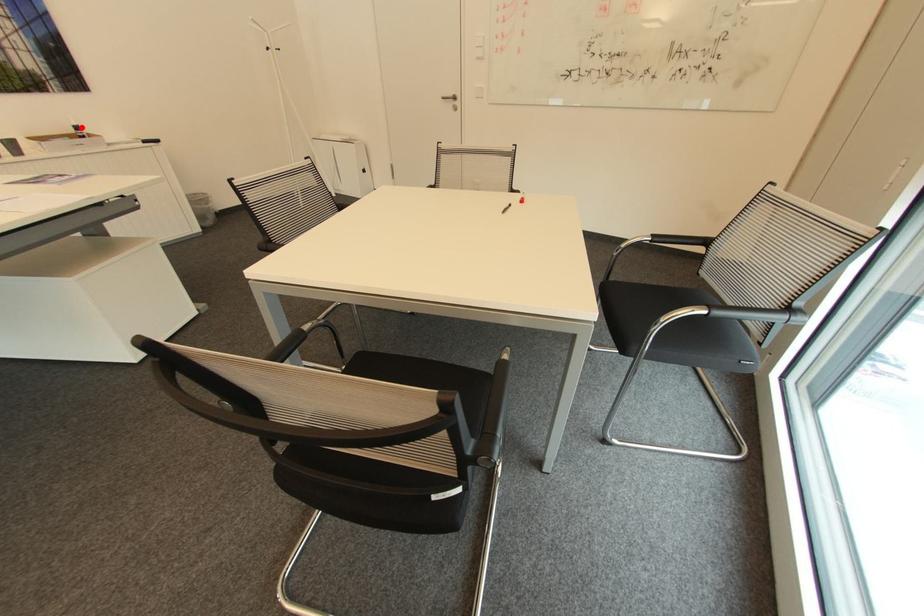
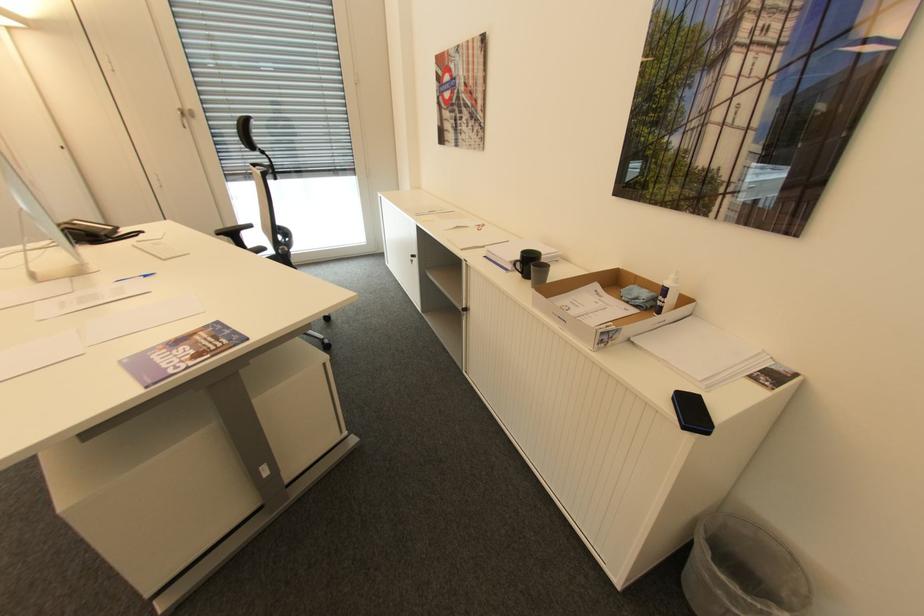
Question: I am providing you with two images of the same scene from different viewpoints. A red point is shown in image1. For the corresponding object point in image2, is it positioned nearer or farther from the camera?

Choices:
 (A) Nearer
 (B) Farther

Answer: (A)